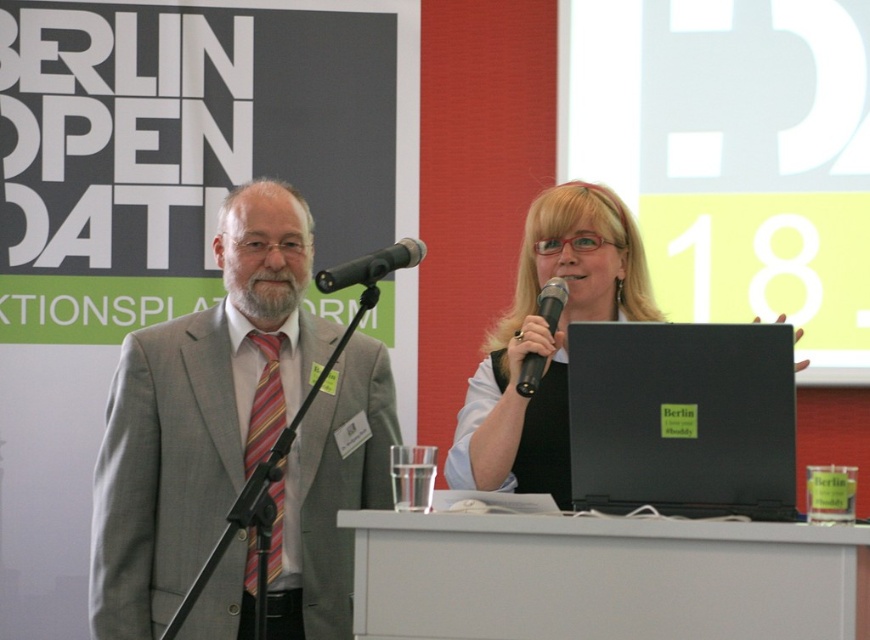
Can you confirm if gray suit at left is positioned above striped fabric tie at left?

Yes.

Does point (164, 397) come behind point (268, 400)?

No, (164, 397) is in front of (268, 400).

At what (x,y) coordinates should I click in order to perform the action: click on gray suit at left. Please return your answer as a coordinate pair (x, y). Looking at the image, I should click on (201, 412).

Between point (335, 506) and point (405, 266), which one is positioned in front?

Point (405, 266)

Between gray suit at left and black metallic microphone at center, which one appears on the right side from the viewer's perspective?

black metallic microphone at center is more to the right.

Image resolution: width=870 pixels, height=640 pixels. What do you see at coordinates (201, 412) in the screenshot?
I see `gray suit at left` at bounding box center [201, 412].

Find the location of a particular element. The image size is (870, 640). gray suit at left is located at coordinates (201, 412).

Can you confirm if black matte laptop at center is smaller than matte black laptop at center?

Yes, black matte laptop at center is smaller than matte black laptop at center.

Based on the photo, is black matte laptop at center below matte black laptop at center?

Yes.

Is point (656, 401) positioned in front of point (529, 472)?

Yes, it is.

The image size is (870, 640). I want to click on black matte laptop at center, so click(681, 419).